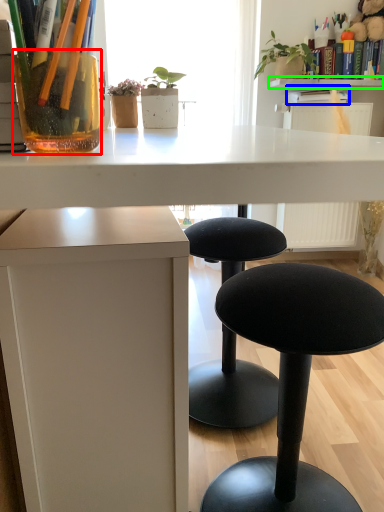
Question: Which object is positioned farthest from vase (highlighted by a red box)? Select from book (highlighted by a blue box) and window sill (highlighted by a green box).

Choices:
 (A) book
 (B) window sill

Answer: (B)